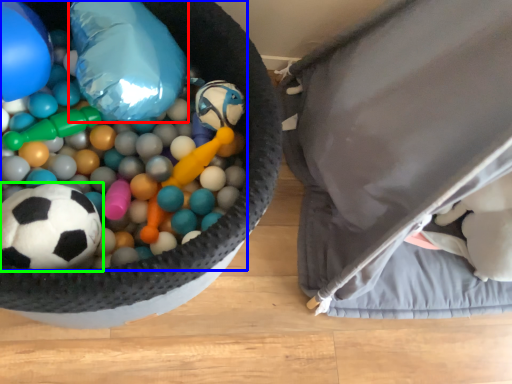
Question: Estimate the real-world distances between objects in this image. Which object is farther from balloon (highlighted by a red box), toy (highlighted by a blue box) or football (highlighted by a green box)?

Choices:
 (A) toy
 (B) football

Answer: (B)